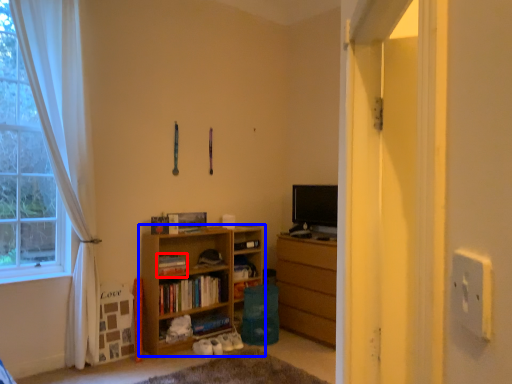
Question: Among these objects, which one is nearest to the camera, book (highlighted by a red box) or bookcase (highlighted by a blue box)?

Choices:
 (A) book
 (B) bookcase

Answer: (B)